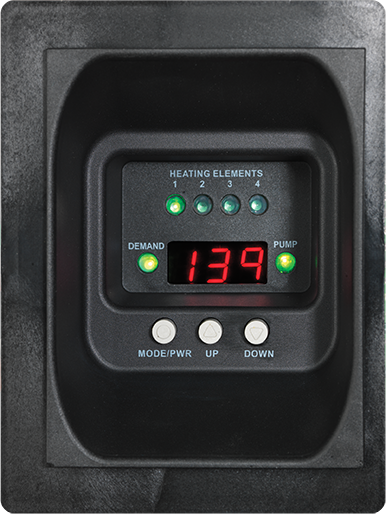
This screenshot has width=386, height=514. In order to click on recess in this screenshot , I will do `click(183, 113)`.